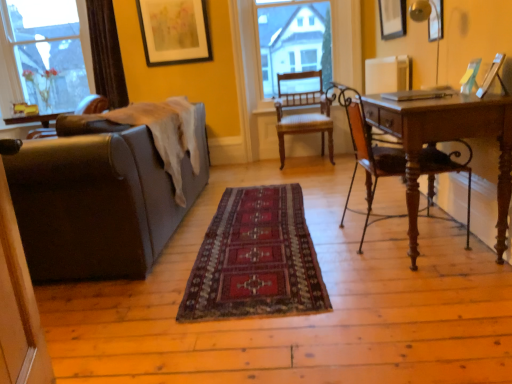
Question: Is point (399, 92) closer or farther from the camera than point (140, 21)?

Choices:
 (A) closer
 (B) farther

Answer: (A)

Question: Looking at their shapes, would you say silver metallic laptop at right is wider or thinner than matte black picture frame at upper center, acting as the 1th picture frame starting from the left?

Choices:
 (A) wide
 (B) thin

Answer: (A)

Question: Which object is positioned closest to the transparent glass chair at upper center?

Choices:
 (A) brown leather couch at left
 (B) silver metallic laptop at right
 (C) matte black picture frame at upper center, placed as the 1th picture frame when sorted from back to front
 (D) clear glass window at upper left
 (E) wooden picture frame at upper right, arranged as the 1th picture frame when viewed from the right

Answer: (C)

Question: Based on their relative distances, which object is farther from the clear glass window at upper left?

Choices:
 (A) matte black picture frame at upper center, placed as the 1th picture frame when sorted from back to front
 (B) transparent glass chair at upper center
 (C) brown leather couch at left
 (D) brown wooden chair at right, the first chair positioned from the front
 (E) wooden picture frame at upper right, the third picture frame positioned from the left

Answer: (D)